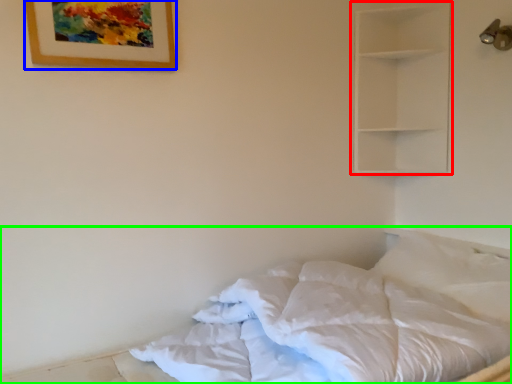
Question: Which object is the closest to the shelf (highlighted by a red box)? Choose among these: picture frame (highlighted by a blue box) or bed (highlighted by a green box).

Choices:
 (A) picture frame
 (B) bed

Answer: (A)